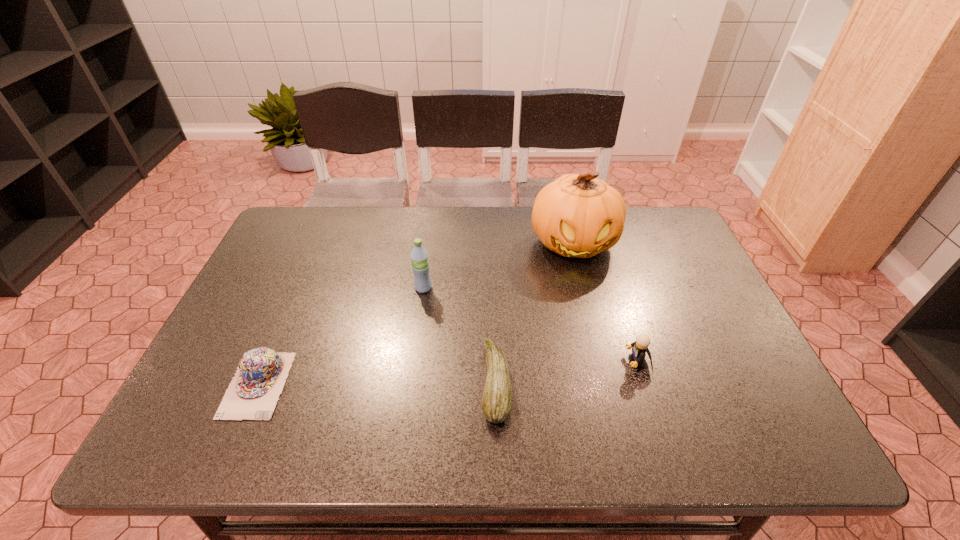
The image size is (960, 540). Find the location of `pumpkin`. pumpkin is located at coordinates (576, 215).

Find the location of a particular element. the farthest object is located at coordinates (576, 215).

The height and width of the screenshot is (540, 960). I want to click on the fourth nearest object, so click(x=419, y=257).

In order to click on the fourth object from right to left in this screenshot , I will do `click(419, 257)`.

At what (x,y) coordinates should I click in order to perform the action: click on Lego. Please return your answer as a coordinate pair (x, y). Looking at the image, I should click on (639, 348).

What are the coordinates of `zucchini` in the screenshot? It's located at (497, 398).

Where is `the leftmost object`? the leftmost object is located at coordinates (252, 394).

Find the location of `vacant space located on the front face of the tallest object`. vacant space located on the front face of the tallest object is located at coordinates (589, 307).

The width and height of the screenshot is (960, 540). I want to click on vacant space located on the left of the second object from left to right, so click(379, 288).

You are a GUI agent. You are given a task and a screenshot of the screen. Output one action in this format:
    pyautogui.click(x=<x>, y=<y>)
    Task: Click on the free region located 0.170m on the front-facing side of the Lego
    The image size is (960, 540).
    Given the screenshot: What is the action you would take?
    pyautogui.click(x=554, y=362)